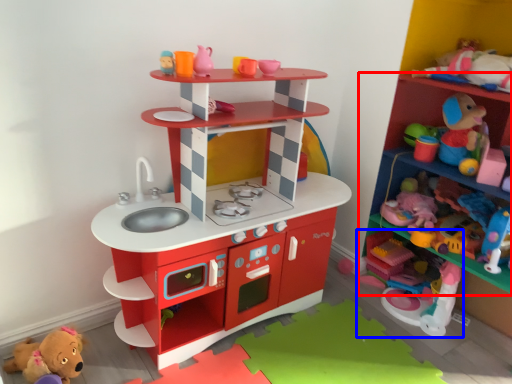
Question: Which object appears closest to the camera in this image, shelf (highlighted by a red box) or toy (highlighted by a blue box)?

Choices:
 (A) shelf
 (B) toy

Answer: (A)